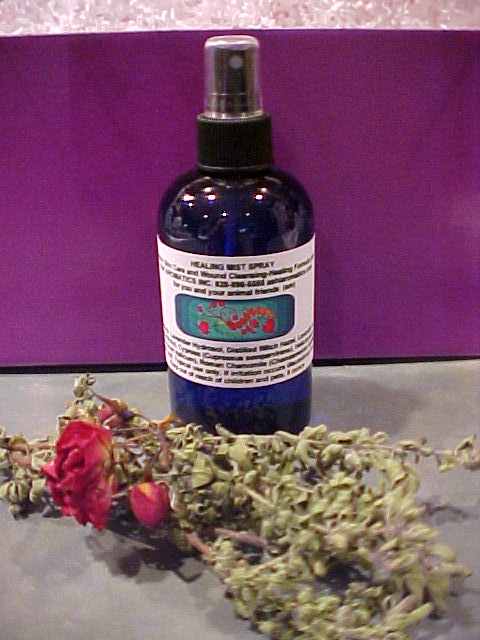
Where is `dried flowers`? The height and width of the screenshot is (640, 480). dried flowers is located at coordinates (159, 480).